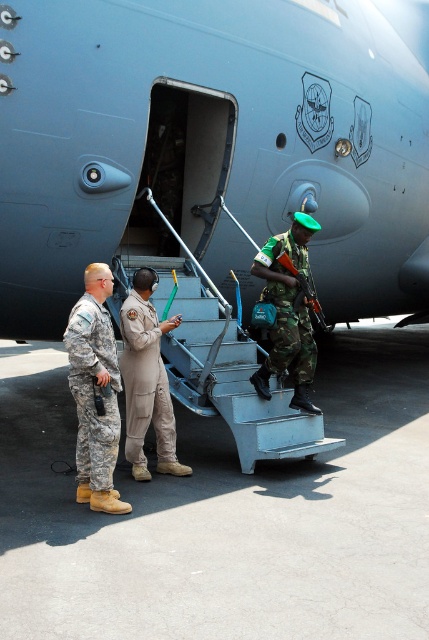
This screenshot has width=429, height=640. I want to click on matte gray airplane at center, so click(210, 147).

Does matte gray airplane at center have a lesser height compared to light blue/stainless steel stairs at center?

Yes.

Does point (129, 112) come closer to viewer compared to point (159, 259)?

Yes, it is in front of point (159, 259).

Is point (395, 275) closer to camera compared to point (250, 436)?

No, (395, 275) is further to viewer.

Where is `matte gray airplane at center`? The image size is (429, 640). matte gray airplane at center is located at coordinates (210, 147).

Looking at this image, does light blue/stainless steel stairs at center have a lesser width compared to camouflage fabric uniform at center?

Incorrect, light blue/stainless steel stairs at center's width is not less than camouflage fabric uniform at center's.

Is light blue/stainless steel stairs at center closer to camera compared to camouflage fabric uniform at center?

Yes.

Is point (204, 380) less distant than point (274, 352)?

Yes, point (204, 380) is in front of point (274, 352).

Where is `light blue/stainless steel stairs at center`? light blue/stainless steel stairs at center is located at coordinates (221, 369).